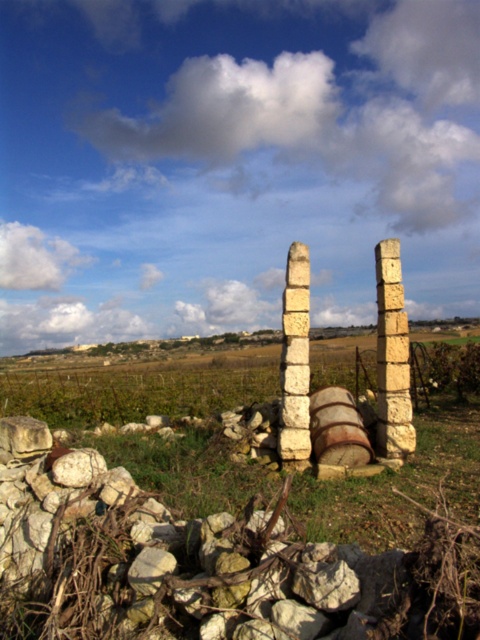
Who is more distant from viewer, (396, 280) or (301, 416)?

The point (396, 280) is behind.

Can you confirm if light beige stone pillar at right is bigger than white stone pillar at center?

Yes, light beige stone pillar at right is bigger than white stone pillar at center.

Between point (387, 426) and point (303, 403), which one is positioned in front?

Positioned in front is point (303, 403).

Identify the location of light beige stone pillar at right. (392, 355).